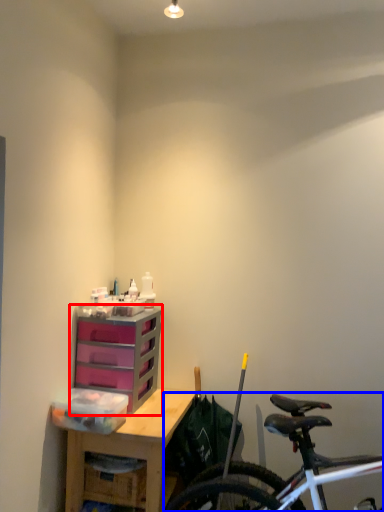
Question: Which object is closer to the camera taking this photo, chest of drawers (highlighted by a red box) or bicycle (highlighted by a blue box)?

Choices:
 (A) chest of drawers
 (B) bicycle

Answer: (B)